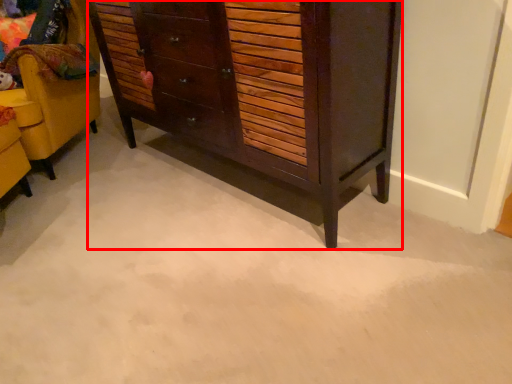
Question: Observing the image, what is the correct spatial positioning of chest of drawers (annotated by the red box) in reference to furniture?

Choices:
 (A) left
 (B) right

Answer: (B)